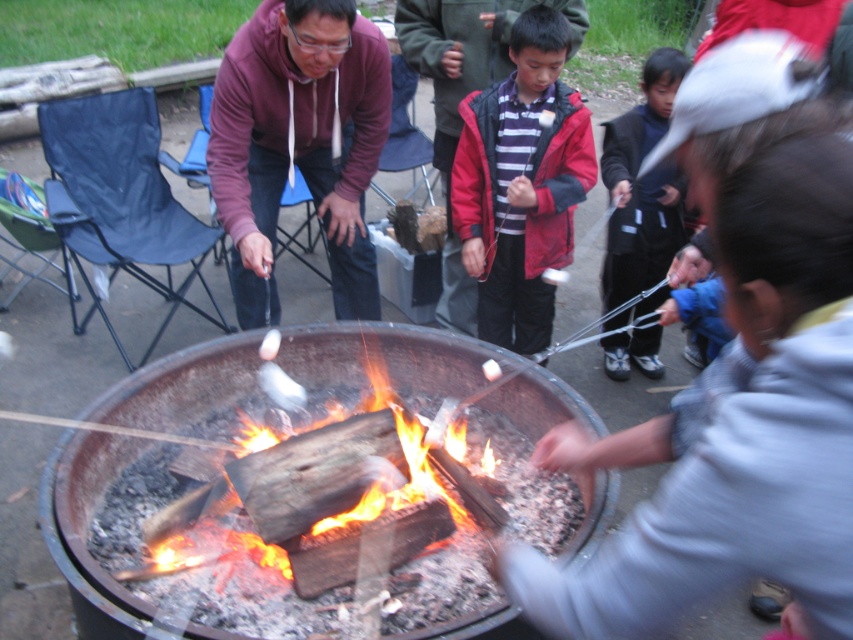
Question: Which of the following is the closest to the observer?

Choices:
 (A) (431, 627)
 (B) (515, 72)

Answer: (A)

Question: Does charcoal fire pit at center have a larger size compared to red matte jacket at center?

Choices:
 (A) no
 (B) yes

Answer: (B)

Question: Which point is closer to the camera?

Choices:
 (A) (704, 280)
 (B) (337, 156)
 (C) (421, 330)
 (D) (566, 122)

Answer: (A)

Question: Does charcoal fire pit at center have a lesser width compared to blue fleece jacket at lower right?

Choices:
 (A) no
 (B) yes

Answer: (A)

Question: Which of the following is the closest to the observer?

Choices:
 (A) blue fleece jacket at lower right
 (B) matte purple hoodie at center
 (C) charcoal fire pit at center
 (D) dark blue pants at lower right

Answer: (C)

Question: Can you confirm if matte purple hoodie at center is wider than dark blue pants at lower right?

Choices:
 (A) yes
 (B) no

Answer: (A)